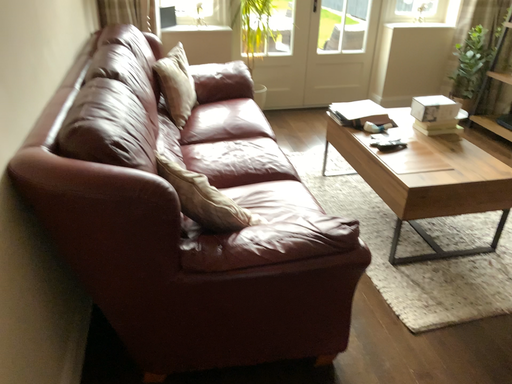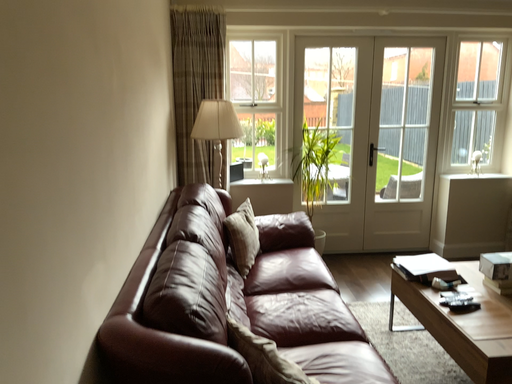
Question: Which way did the camera rotate in the video?

Choices:
 (A) rotated right
 (B) rotated left

Answer: (B)